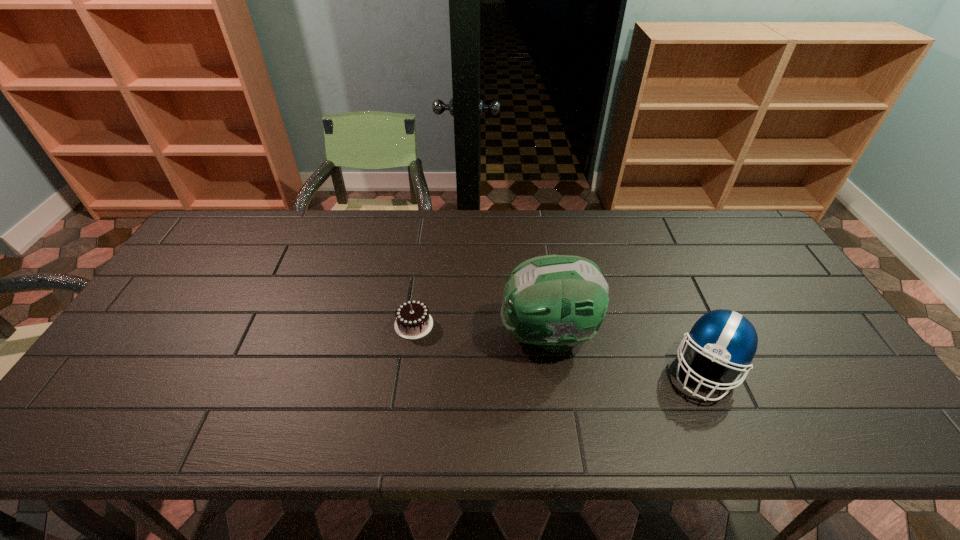
Locate an element on the screen. The width and height of the screenshot is (960, 540). vacant space located on the right of the chocolate cake is located at coordinates (544, 325).

The image size is (960, 540). I want to click on object at the near edge, so click(x=726, y=337).

I want to click on blank space at the far edge of the desktop, so click(x=282, y=221).

I want to click on vacant space at the near edge of the desktop, so click(x=529, y=408).

You are a GUI agent. You are given a task and a screenshot of the screen. Output one action in this format:
    pyautogui.click(x=<x>, y=<y>)
    Task: Click on the free location at the right edge
    Image resolution: width=960 pixels, height=540 pixels.
    Given the screenshot: What is the action you would take?
    pyautogui.click(x=828, y=379)

In order to click on blank space at the far left corner of the desktop in this screenshot , I will do `click(216, 222)`.

Where is `vacant area at the near left corner of the desktop`? vacant area at the near left corner of the desktop is located at coordinates (119, 418).

Where is `free location at the far right corner of the desktop`? The height and width of the screenshot is (540, 960). free location at the far right corner of the desktop is located at coordinates (720, 215).

Identify the location of free space at the near right corner of the desktop. (908, 440).

Locate an element on the screen. free space between the left football helmet and the chocolate cake is located at coordinates (481, 330).